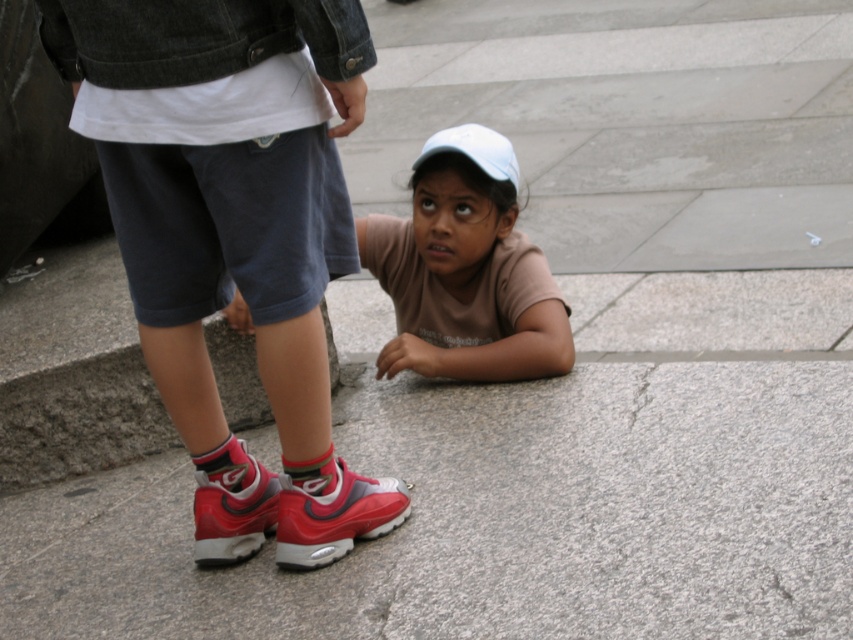
You are standing in an urban plaza and see two points marked in the image. Which point, point (161, 253) or point (459, 209), is closer to your current position?

Point (161, 253) is closer to the camera than point (459, 209), so it is closer to your current position.

You are a photographer trying to capture a photo of the brown cotton shirt at lower center without including the matte red sneakers at lower left in the frame. Given their positions and heights, is this possible?

The matte red sneakers at lower left has a greater height compared to brown cotton shirt at lower center. Since the sneakers are taller, they might block the view of the shirt unless you adjust your angle or position to lower your perspective so the shirt is visible while the sneakers are out of frame.

You are a delivery person who needs to place a package between the matte red sneakers at lower left and the brown cotton shirt at lower center. The package requires a minimum of 3 feet of space. Can you fit it there?

The distance between the matte red sneakers at lower left and the brown cotton shirt at lower center is 36.27 inches, which is exactly 3.02 feet. Since the package requires a minimum of 3 feet of space, it can just barely fit between them.